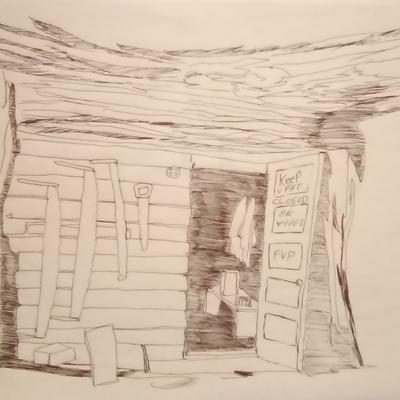
The height and width of the screenshot is (400, 400). In order to click on handle in this screenshot , I will do tap(108, 160), tap(137, 188), tap(86, 165), tap(70, 319), tap(29, 334), tap(35, 184).